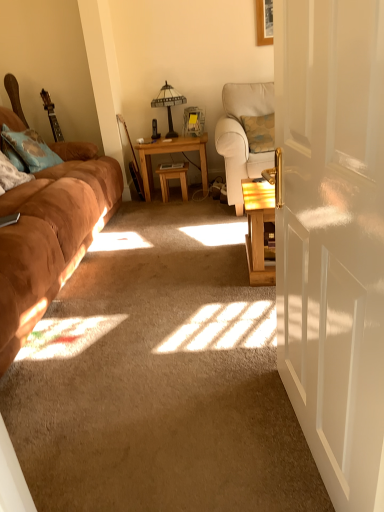
The height and width of the screenshot is (512, 384). In order to click on light beige fabric chair at center right in this screenshot , I will do `click(242, 135)`.

Image resolution: width=384 pixels, height=512 pixels. Describe the element at coordinates (242, 135) in the screenshot. I see `light beige fabric chair at center right` at that location.

Measure the distance between light brown wooden table at center, which is the first table from left to right, and camera.

light brown wooden table at center, which is the first table from left to right, is 12.05 feet from camera.

This screenshot has width=384, height=512. I want to click on white glossy door at center right, so click(333, 237).

Is light brown wooden table at center, placed as the second table when sorted from right to left, oriented towards matte glass table lamp at center?

No, light brown wooden table at center, placed as the second table when sorted from right to left, is not facing towards matte glass table lamp at center.

This screenshot has height=512, width=384. Identify the location of table that is the 1st one below the matte glass table lamp at center (from a real-world perspective). (171, 153).

Is point (181, 145) closer or farther from the camera than point (168, 96)?

Point (181, 145).

Is light brown wooden table at center, which is the first table from left to right, placed right next to matte glass table lamp at center?

No, light brown wooden table at center, which is the first table from left to right, is not next to matte glass table lamp at center.

Find the location of a particular element. This screenshot has width=384, height=512. pillow located above the matte plastic picture frame at center (from a real-world perspective) is located at coordinates (28, 150).

Considering the sizes of objects blue textured pillow at left and matte plastic picture frame at center in the image provided, who is taller, blue textured pillow at left or matte plastic picture frame at center?

Standing taller between the two is blue textured pillow at left.

From the image's perspective, is blue textured pillow at left below matte plastic picture frame at center?

Correct, blue textured pillow at left appears lower than matte plastic picture frame at center in the image.

Consider the image. Can you confirm if suede brown couch at left is taller than wooden table at center, acting as the 1th table starting from the right?

Correct, suede brown couch at left is much taller as wooden table at center, acting as the 1th table starting from the right.

Considering the sizes of suede brown couch at left and wooden table at center, which is counted as the 2th table, starting from the left, in the image, is suede brown couch at left bigger or smaller than wooden table at center, which is counted as the 2th table, starting from the left,?

Considering their sizes, suede brown couch at left takes up more space than wooden table at center, which is counted as the 2th table, starting from the left.

Which object is positioned more to the left, suede brown couch at left or wooden table at center, acting as the 1th table starting from the right?

Positioned to the left is suede brown couch at left.

From a real-world perspective, who is located lower, suede brown couch at left or wooden table at center, acting as the 1th table starting from the right?

In real-world perspective, wooden table at center, acting as the 1th table starting from the right, is lower.

Can you confirm if light beige fabric chair at center right is wider than matte plastic picture frame at center?

Yes.

Could you tell me if light beige fabric chair at center right is turned towards matte plastic picture frame at center?

No, light beige fabric chair at center right is not turned towards matte plastic picture frame at center.

Considering the positions of objects light beige fabric chair at center right and matte plastic picture frame at center in the image provided, who is behind, light beige fabric chair at center right or matte plastic picture frame at center?

Positioned behind is matte plastic picture frame at center.

How different are the orientations of light beige fabric chair at center right and matte plastic picture frame at center in degrees?

light beige fabric chair at center right and matte plastic picture frame at center are facing 24.7 degrees away from each other.

Locate an element on the screen. The image size is (384, 512). door on the right of blue textured pillow at left is located at coordinates [x=333, y=237].

Can you tell me how much blue textured pillow at left and white glossy door at center right differ in facing direction?

166 degrees.

From the image's perspective, is blue textured pillow at left on white glossy door at center right?

Yes, from the image's perspective, blue textured pillow at left is above white glossy door at center right.

How many degrees apart are the facing directions of light beige fabric chair at center right and light brown wooden table at center, which is the first table from left to right?

1.56 degrees.

Based on the photo, can we say light beige fabric chair at center right lies outside light brown wooden table at center, placed as the second table when sorted from right to left?

light beige fabric chair at center right is positioned outside light brown wooden table at center, placed as the second table when sorted from right to left.

Looking at this image, is light beige fabric chair at center right oriented away from light brown wooden table at center, which is the first table from left to right?

No, light beige fabric chair at center right is not facing the opposite direction of light brown wooden table at center, which is the first table from left to right.

Considering the relative sizes of light beige fabric chair at center right and light brown wooden table at center, which is the first table from left to right, in the image provided, is light beige fabric chair at center right wider than light brown wooden table at center, which is the first table from left to right,?

Correct, the width of light beige fabric chair at center right exceeds that of light brown wooden table at center, which is the first table from left to right.

Is white glossy door at center right at the back of wooden table at center, which is counted as the 2th table, starting from the left?

Yes, wooden table at center, which is counted as the 2th table, starting from the left, is positioned with its back facing white glossy door at center right.

Which is more to the right, wooden table at center, which is counted as the 2th table, starting from the left, or white glossy door at center right?

white glossy door at center right.

Which is in front, wooden table at center, which is counted as the 2th table, starting from the left, or white glossy door at center right?

white glossy door at center right is in front.

From a real-world perspective, is wooden table at center, acting as the 1th table starting from the right, above or below white glossy door at center right?

From a real-world perspective, wooden table at center, acting as the 1th table starting from the right, is physically below white glossy door at center right.

From the matte glass table lamp at center, count 1st table to the right and point to it. Please provide its 2D coordinates.

[(171, 153)]

In the image, there is a blue textured pillow at left. At what (x,y) coordinates should I click in order to perform the action: click on picture frame below it (from a real-world perspective). Please return your answer as a coordinate pair (x, y). The width and height of the screenshot is (384, 512). Looking at the image, I should click on (193, 121).

Based on the photo, estimate the real-world distances between objects in this image. Which object is further from white glossy door at center right, blue textured pillow at left or light beige fabric chair at center right?

blue textured pillow at left lies further to white glossy door at center right than the other object.

Based on their spatial positions, is wooden table at center, acting as the 1th table starting from the right, or light beige fabric chair at center right further from light brown wooden table at center, placed as the second table when sorted from right to left?

Among the two, light beige fabric chair at center right is located further to light brown wooden table at center, placed as the second table when sorted from right to left.

Estimate the real-world distances between objects in this image. Which object is closer to matte glass table lamp at center, blue textured pillow at left or suede brown couch at left?

blue textured pillow at left.

Estimate the real-world distances between objects in this image. Which object is closer to matte glass table lamp at center, wooden table at center, which is counted as the 2th table, starting from the left, or white glossy door at center right?

Based on the image, wooden table at center, which is counted as the 2th table, starting from the left, appears to be nearer to matte glass table lamp at center.

Based on their spatial positions, is suede brown couch at left or light brown wooden table at center, placed as the second table when sorted from right to left, closer to matte plastic picture frame at center?

light brown wooden table at center, placed as the second table when sorted from right to left, is closer to matte plastic picture frame at center.

Looking at the image, which one is located closer to blue textured pillow at left, wooden table at center, which is counted as the 2th table, starting from the left, or matte glass table lamp at center?

Based on the image, wooden table at center, which is counted as the 2th table, starting from the left, appears to be nearer to blue textured pillow at left.

Based on the photo, based on their spatial positions, is light brown wooden table at center, which is the first table from left to right, or white glossy door at center right further from light beige fabric chair at center right?

white glossy door at center right.

Looking at the image, which one is located closer to light beige fabric chair at center right, matte plastic picture frame at center or suede brown couch at left?

matte plastic picture frame at center is closer to light beige fabric chair at center right.

Where is `chair positioned between white glossy door at center right and matte glass table lamp at center from near to far`? Image resolution: width=384 pixels, height=512 pixels. chair positioned between white glossy door at center right and matte glass table lamp at center from near to far is located at coordinates (242, 135).

What are the coordinates of `table lamp positioned between suede brown couch at left and wooden table at center, acting as the 1th table starting from the right, from near to far` in the screenshot? It's located at (169, 104).

Locate an element on the screen. table lamp between white glossy door at center right and wooden table at center, which is counted as the 2th table, starting from the left, from front to back is located at coordinates (169, 104).

What are the coordinates of `pillow between suede brown couch at left and matte glass table lamp at center from front to back` in the screenshot? It's located at (28, 150).